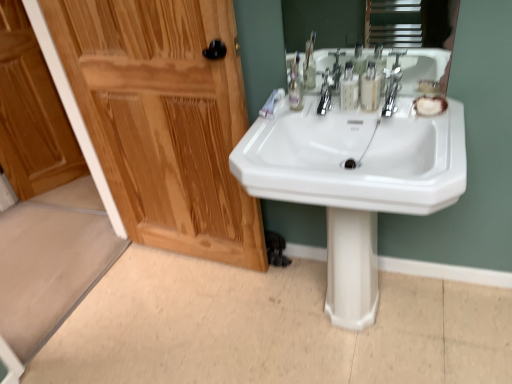
Image resolution: width=512 pixels, height=384 pixels. In order to click on free spot to the left of white glossy pedestal at center in this screenshot , I will do `click(304, 312)`.